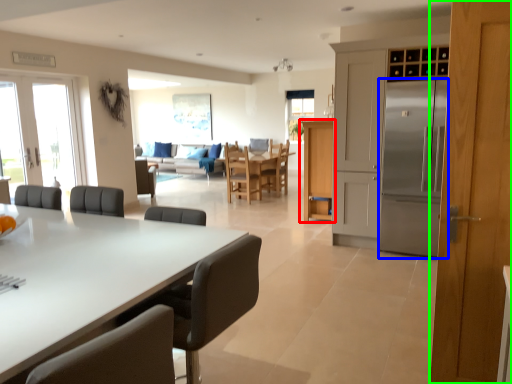
Question: Which object is positioned closest to cabinetry (highlighted by a red box)? Select from refrigerator (highlighted by a blue box) and door (highlighted by a green box).

Choices:
 (A) refrigerator
 (B) door

Answer: (A)